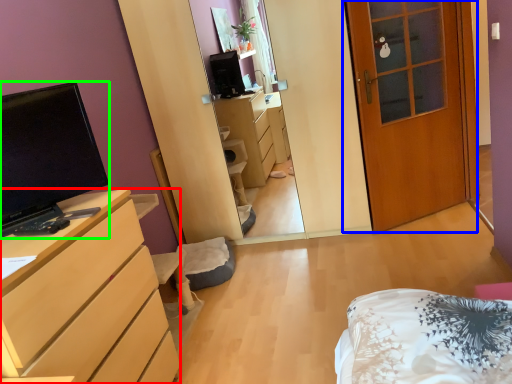
Question: Which object is positioned farthest from cabinetry (highlighted by a red box)? Select from door (highlighted by a blue box) and television (highlighted by a green box).

Choices:
 (A) door
 (B) television

Answer: (A)